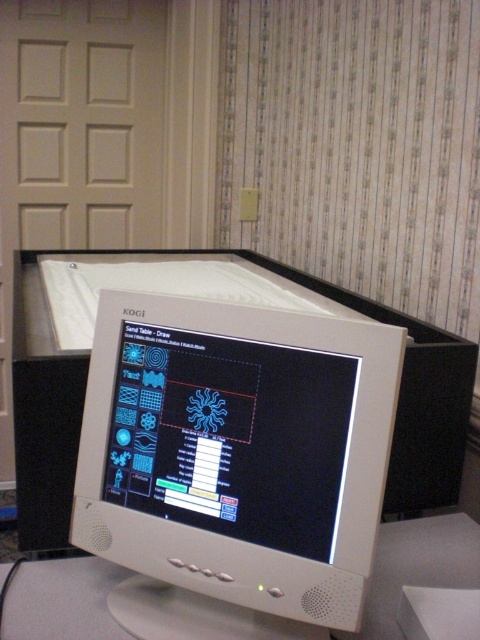
Is white plastic monitor at center positioned in front of white plastic computer desk at center?

That is True.

Is white plastic monitor at center to the left of white plastic computer desk at center from the viewer's perspective?

Yes, white plastic monitor at center is to the left of white plastic computer desk at center.

Who is more forward, (215, 499) or (384, 632)?

Point (215, 499)

Identify the location of white plastic monitor at center. (235, 465).